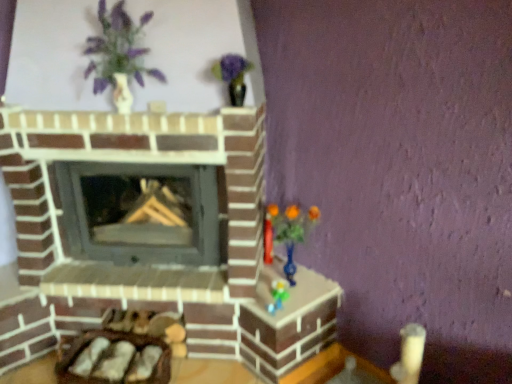
I want to click on vacant space in matte white vase at upper left (from a real-world perspective), so click(148, 272).